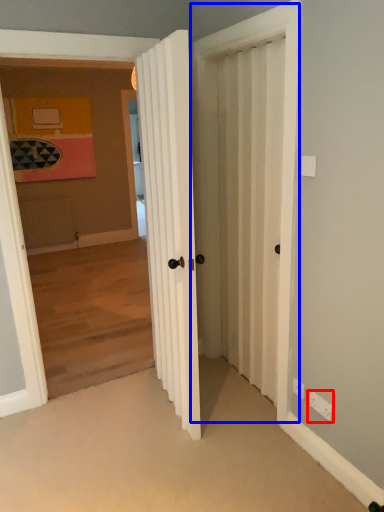
Question: Which of the following is the closest to the observer, electric outlet (highlighted by a red box) or screen door (highlighted by a blue box)?

Choices:
 (A) electric outlet
 (B) screen door

Answer: (B)